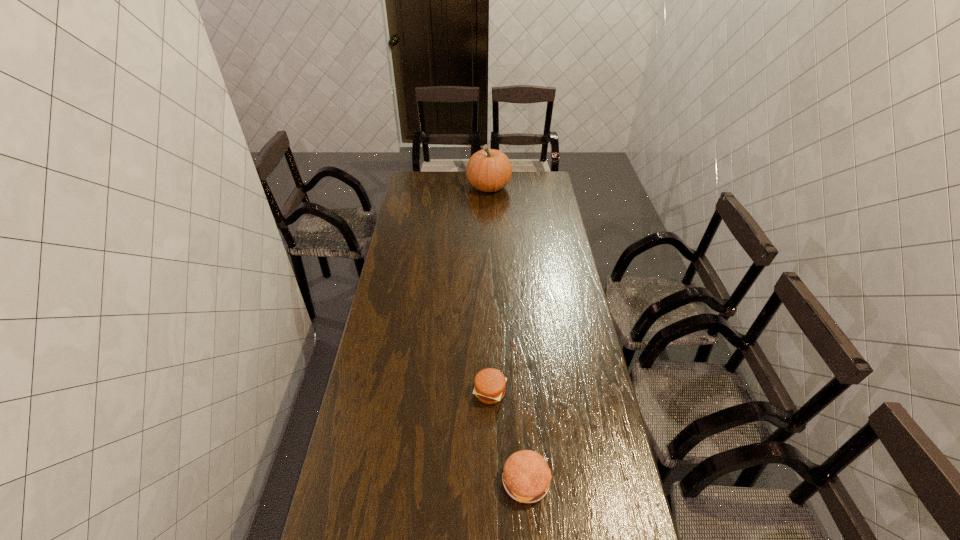
You are a GUI agent. You are given a task and a screenshot of the screen. Output one action in this format:
    pyautogui.click(x=<x>, y=<y>)
    Task: Click on the free region at the far edge
    The width and height of the screenshot is (960, 540).
    Given the screenshot: What is the action you would take?
    pyautogui.click(x=513, y=179)

The image size is (960, 540). What are the coordinates of `vacant area at the left edge` in the screenshot? It's located at (347, 488).

The image size is (960, 540). I want to click on free space at the right edge, so click(x=537, y=215).

The height and width of the screenshot is (540, 960). In order to click on blank area at the far left corner in this screenshot , I will do `click(427, 191)`.

Where is `free area in between the farther hamburger and the pumpkin`? free area in between the farther hamburger and the pumpkin is located at coordinates (490, 289).

Where is `unoccupied position between the pumpkin and the farther hamburger`? unoccupied position between the pumpkin and the farther hamburger is located at coordinates (490, 289).

This screenshot has width=960, height=540. Find the location of `free space between the nearer hamburger and the farthest object`. free space between the nearer hamburger and the farthest object is located at coordinates (508, 334).

Find the location of a particular element. vacant area that lies between the farthest object and the farther hamburger is located at coordinates (490, 289).

The width and height of the screenshot is (960, 540). In order to click on free spot between the nearest object and the tallest object in this screenshot , I will do `click(508, 334)`.

Locate an element on the screen. free spot between the pumpkin and the farther hamburger is located at coordinates (490, 289).